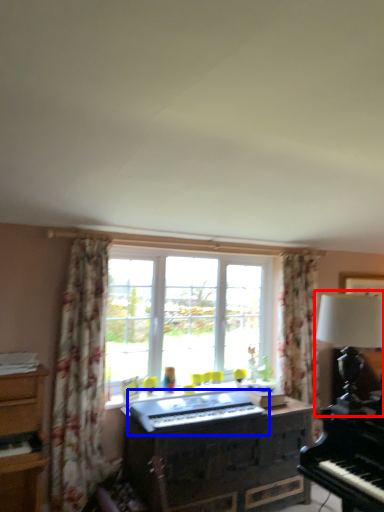
Question: Which object appears closest to the camera in this image, table lamp (highlighted by a red box) or musical keyboard (highlighted by a blue box)?

Choices:
 (A) table lamp
 (B) musical keyboard

Answer: (A)